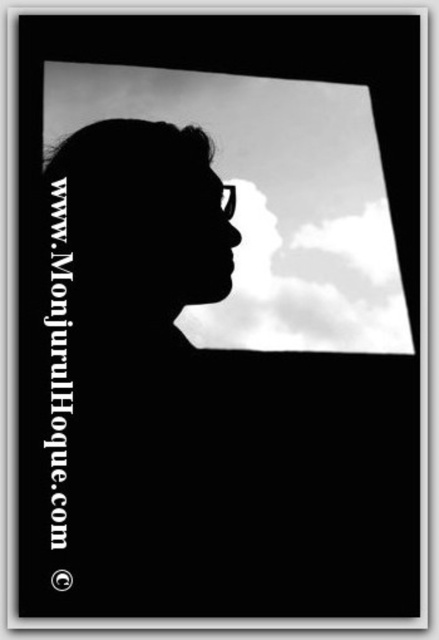
You are an artist planning to paint a scene similar to the one described. You want to ensure that the cloudy sky at upper center and the white fluffy cloud at center are arranged correctly. Based on the scene description, which object should be placed higher in your painting?

The cloudy sky at upper center should be placed higher than the white fluffy cloud at center because the cloudy sky at upper center is positioned over the white fluffy cloud at center.

You are an astronomer observing the night sky. You notice the cloudy sky at upper center and the white fluffy cloud at center. Which object is positioned higher in the image?

The cloudy sky at upper center is positioned higher than the white fluffy cloud at center.